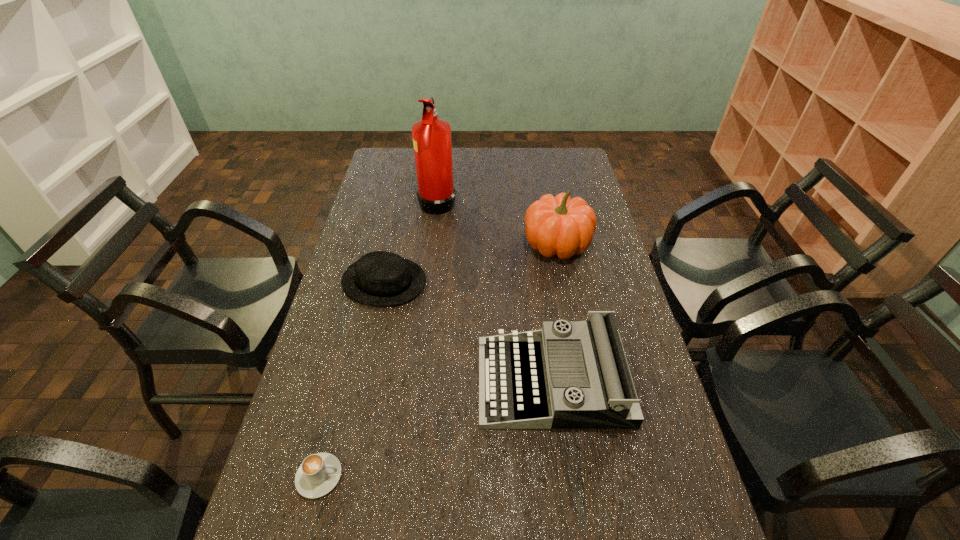
Identify the location of vacant area situated 0.200m on the typing side of the typewriter. (403, 381).

Find the location of `vacant space located on the typing side of the typewriter`. vacant space located on the typing side of the typewriter is located at coordinates (365, 381).

The width and height of the screenshot is (960, 540). I want to click on free location located 0.360m on the typing side of the typewriter, so click(x=342, y=381).

Find the location of `free space located on the back of the second shortest object`. free space located on the back of the second shortest object is located at coordinates (399, 211).

Locate an element on the screen. The height and width of the screenshot is (540, 960). free space located 0.400m to the right of the shortest object is located at coordinates (521, 476).

Locate an element on the screen. fedora at the left edge is located at coordinates (381, 278).

Where is `cappuccino that is at the left edge`? cappuccino that is at the left edge is located at coordinates (318, 474).

The image size is (960, 540). In order to click on pumpkin present at the right edge in this screenshot , I will do `click(559, 225)`.

Identify the location of typewriter positioned at the right edge. The image size is (960, 540). (569, 375).

I want to click on free region at the far edge, so click(x=515, y=157).